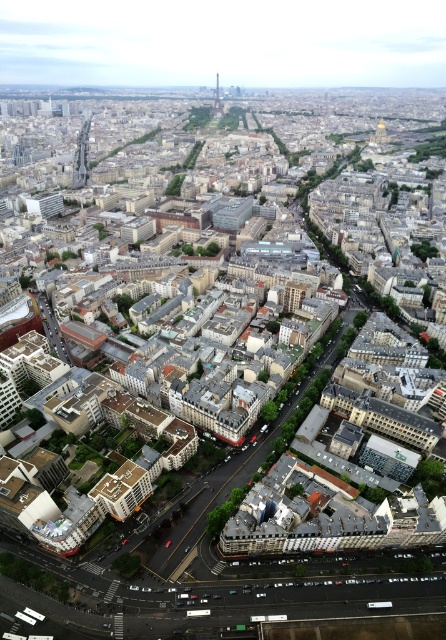
Question: Is smooth glass skyscraper at upper left to the right of shiny metallic tower at center from the viewer's perspective?

Choices:
 (A) yes
 (B) no

Answer: (B)

Question: Which of the following is the closest to the observer?

Choices:
 (A) smooth glass skyscraper at upper left
 (B) shiny metallic tower at center

Answer: (A)

Question: Which object is farther from the camera taking this photo?

Choices:
 (A) smooth glass skyscraper at upper left
 (B) shiny metallic tower at center

Answer: (B)

Question: Is smooth glass skyscraper at upper left behind shiny metallic tower at center?

Choices:
 (A) no
 (B) yes

Answer: (A)

Question: Is smooth glass skyscraper at upper left bigger than shiny metallic tower at center?

Choices:
 (A) yes
 (B) no

Answer: (A)